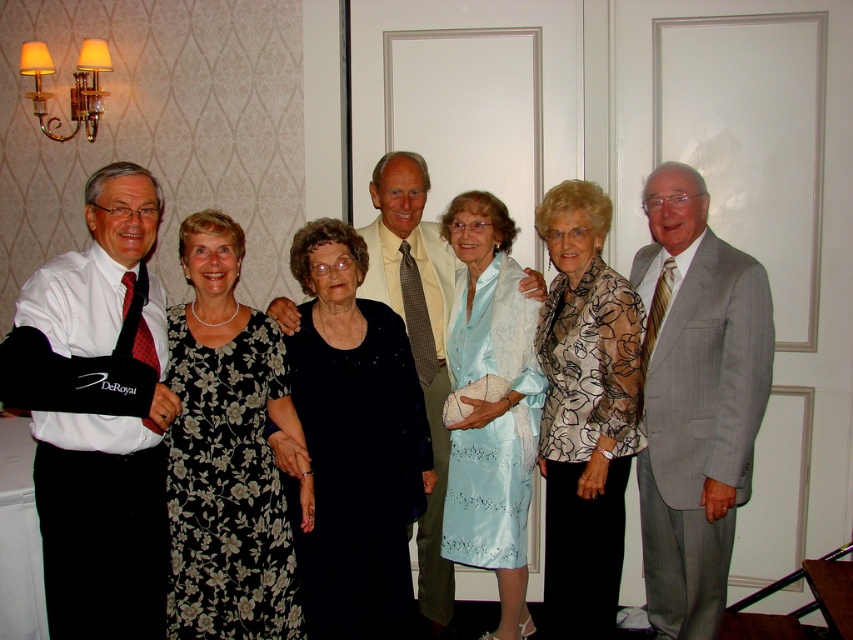
You are a photographer adjusting your camera settings. You need to focus on the gray pinstripe suit at right and the satin dress at center. Which one should you adjust your focus for first?

The gray pinstripe suit at right is closer to the viewer than the satin dress at center, so you should focus on the gray pinstripe suit at right first.

You are standing in front of the group of seven individuals at the formal event. There are two points marked in the image, one at coordinates point (x=734, y=323) and the other at point (x=283, y=573). Which of these two points is closer to your viewpoint?

Point (x=734, y=323) is closer to your viewpoint because it is further to the camera than point (x=283, y=573).